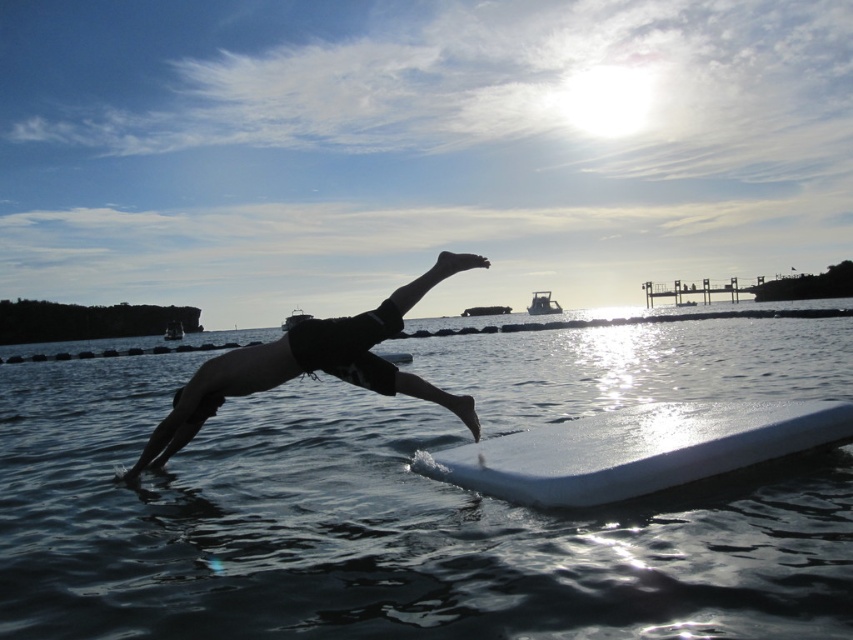
Consider the image. You are a photographer trying to capture the perfect shot of the diver and the surfboard. Based on the scene, where should you position your camera to ensure both the white foam surfboard at center and the black matte shorts at center are clearly visible in the same frame?

Since the white foam surfboard at center is located below the black matte shorts at center, position your camera so it can capture both the lower and upper parts of the scene. Ensure the camera is angled downward slightly to include the surfboard beneath the diver while keeping the shorts in the upper portion of the frame.

You are a photographer trying to capture the perfect shot of the diver and the surfboard. Based on the scene, which object is closer to the camera? The transparent water at center or the black matte shorts at center?

The transparent water at center is closer to the camera because it is in front of the black matte shorts at center.